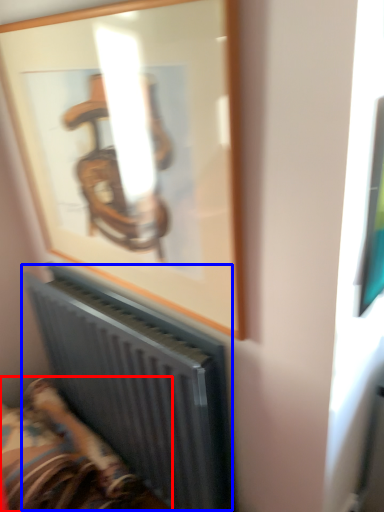
Question: Among these objects, which one is nearest to the camera, furniture (highlighted by a red box) or radiator (highlighted by a blue box)?

Choices:
 (A) furniture
 (B) radiator

Answer: (B)